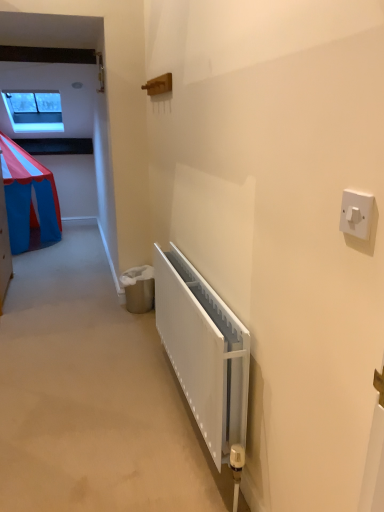
Question: Considering the relative sizes of white matte radiator at lower center and white plastic light switch at upper right in the image provided, is white matte radiator at lower center thinner than white plastic light switch at upper right?

Choices:
 (A) yes
 (B) no

Answer: (B)

Question: Can you confirm if white matte radiator at lower center is positioned to the left of white plastic light switch at upper right?

Choices:
 (A) yes
 (B) no

Answer: (A)

Question: Would you say white plastic light switch at upper right is part of white matte radiator at lower center's contents?

Choices:
 (A) yes
 (B) no

Answer: (B)

Question: From the image's perspective, does white matte radiator at lower center appear lower than white plastic light switch at upper right?

Choices:
 (A) no
 (B) yes

Answer: (B)

Question: Is white matte radiator at lower center at the right side of white plastic light switch at upper right?

Choices:
 (A) yes
 (B) no

Answer: (B)

Question: Is white plastic light switch at upper right in front of or behind transparent glass window at upper left in the image?

Choices:
 (A) front
 (B) behind

Answer: (A)

Question: Based on their positions, is white plastic light switch at upper right located to the left or right of transparent glass window at upper left?

Choices:
 (A) left
 (B) right

Answer: (B)

Question: Is white plastic light switch at upper right wider or thinner than transparent glass window at upper left?

Choices:
 (A) thin
 (B) wide

Answer: (A)

Question: From a real-world perspective, relative to transparent glass window at upper left, is white plastic light switch at upper right vertically above or below?

Choices:
 (A) above
 (B) below

Answer: (B)

Question: From a real-world perspective, is transparent glass window at upper left above or below white plastic light switch at upper right?

Choices:
 (A) above
 (B) below

Answer: (A)

Question: Considering the positions of transparent glass window at upper left and white plastic light switch at upper right in the image, is transparent glass window at upper left wider or thinner than white plastic light switch at upper right?

Choices:
 (A) wide
 (B) thin

Answer: (A)

Question: From the image's perspective, relative to white plastic light switch at upper right, is transparent glass window at upper left above or below?

Choices:
 (A) above
 (B) below

Answer: (A)

Question: Based on their sizes in the image, would you say transparent glass window at upper left is bigger or smaller than white plastic light switch at upper right?

Choices:
 (A) big
 (B) small

Answer: (A)

Question: From the image's perspective, is white matte radiator at lower center located above or below transparent glass window at upper left?

Choices:
 (A) above
 (B) below

Answer: (B)

Question: In the image, is white matte radiator at lower center on the left side or the right side of transparent glass window at upper left?

Choices:
 (A) left
 (B) right

Answer: (B)